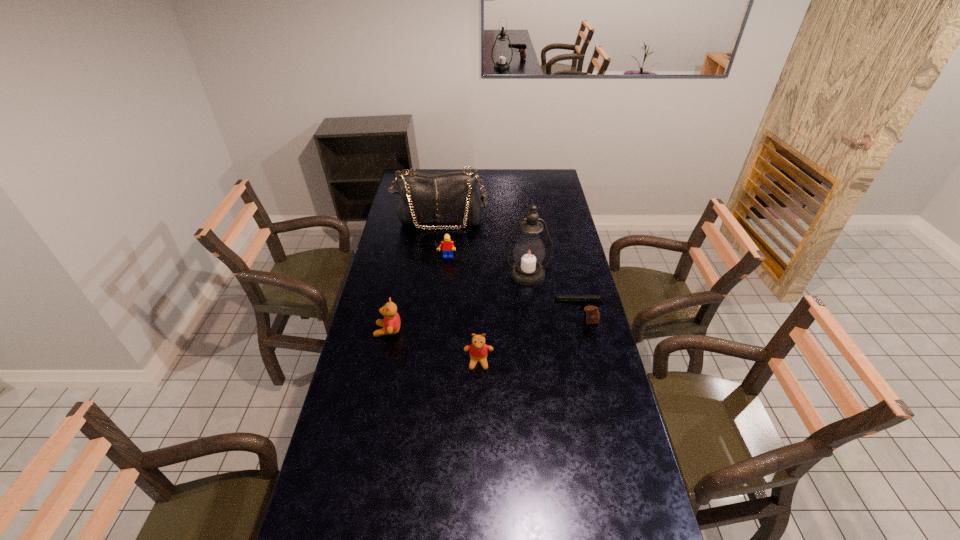
Locate an element on the screen. Image resolution: width=960 pixels, height=540 pixels. free area in between the third farthest object and the shorter teddy bear is located at coordinates (503, 318).

Where is `free spot between the nearer teddy bear and the pistol`? This screenshot has width=960, height=540. free spot between the nearer teddy bear and the pistol is located at coordinates (527, 342).

Locate an element on the screen. This screenshot has height=540, width=960. vacant area that lies between the farther teddy bear and the farthest object is located at coordinates (414, 275).

Where is `vacant space that's between the shorter teddy bear and the farthest object`? The height and width of the screenshot is (540, 960). vacant space that's between the shorter teddy bear and the farthest object is located at coordinates (460, 291).

You are a GUI agent. You are given a task and a screenshot of the screen. Output one action in this format:
    pyautogui.click(x=<x>, y=<y>)
    Task: Click on the empty space that is in between the farther teddy bear and the nearer teddy bear
    
    Given the screenshot: What is the action you would take?
    (433, 346)

Locate an element on the screen. The height and width of the screenshot is (540, 960). object that is the fifth closest one to the left teddy bear is located at coordinates (450, 197).

Choose which object is the fourth nearest neighbor to the handbag. Please provide its 2D coordinates. Your answer should be formatted as a tuple, i.e. [(x, y)], where the tuple contains the x and y coordinates of a point satisfying the conditions above.

[(590, 303)]

This screenshot has height=540, width=960. I want to click on vacant space that satisfies the following two spatial constraints: 1. at the barrel of the pistol; 2. on the front-facing side of the right teddy bear, so click(x=584, y=362).

You are a GUI agent. You are given a task and a screenshot of the screen. Output one action in this format:
    pyautogui.click(x=<x>, y=<y>)
    Task: Click on the free spot that satisfies the following two spatial constraints: 1. at the front of the second tallest object with chain and zipper; 2. on the front-facing side of the farther teddy bear
    The image size is (960, 540).
    Given the screenshot: What is the action you would take?
    pyautogui.click(x=427, y=330)

The height and width of the screenshot is (540, 960). In order to click on free spot that satisfies the following two spatial constraints: 1. at the barrel of the pistol; 2. on the front-facing side of the shorter teddy bear in this screenshot , I will do `click(584, 362)`.